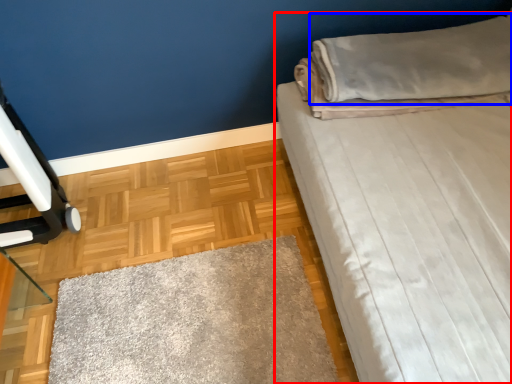
Question: Which point is closer to the camera, bed (highlighted by a red box) or pillow (highlighted by a blue box)?

Choices:
 (A) bed
 (B) pillow

Answer: (A)